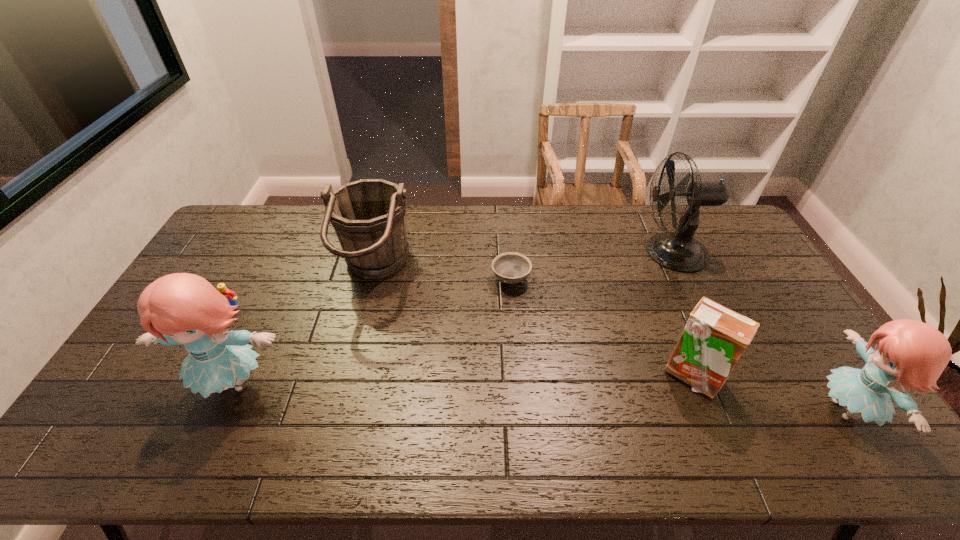
Identify which object is the second nearest to the left doll. Please provide its 2D coordinates. Your answer should be formatted as a tuple, i.e. [(x, y)], where the tuple contains the x and y coordinates of a point satisfying the conditions above.

[(230, 295)]

You are a GUI agent. You are given a task and a screenshot of the screen. Output one action in this format:
    pyautogui.click(x=<x>, y=<y>)
    Task: Click on the free space that satisfies the following two spatial constraints: 1. on the handle side of the bucket; 2. on the front-facing side of the taller doll
    
    Given the screenshot: What is the action you would take?
    pyautogui.click(x=347, y=383)

Locate an element on the screen. Image resolution: width=960 pixels, height=540 pixels. vacant region that satisfies the following two spatial constraints: 1. on the front-facing side of the fan; 2. on the straw side of the carton is located at coordinates (731, 375).